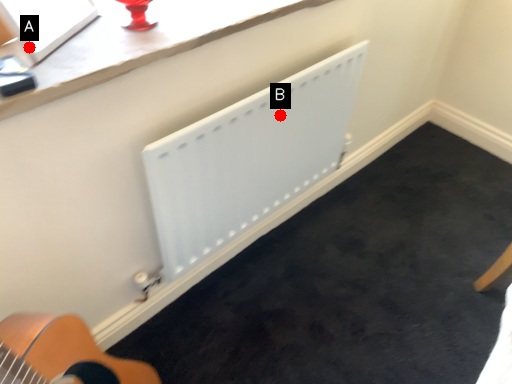
Question: Two points are circled on the image, labeled by A and B beside each circle. Which point appears closest to the camera in this image?

Choices:
 (A) A is closer
 (B) B is closer

Answer: (A)